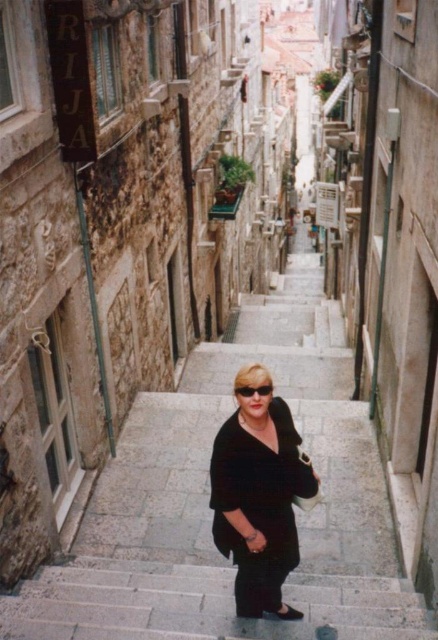
Question: Which point is closer to the camera?

Choices:
 (A) (x=246, y=394)
 (B) (x=274, y=616)
 (C) (x=257, y=540)

Answer: (A)

Question: Which point appears farthest from the camera in this image?

Choices:
 (A) (163, 616)
 (B) (269, 387)
 (C) (212, 586)

Answer: (C)

Question: Can you confirm if stone stairs at center is wider than black matte dress at center?

Choices:
 (A) yes
 (B) no

Answer: (A)

Question: Does smooth stone stairs at center lie in front of black matte sunglasses at center?

Choices:
 (A) no
 (B) yes

Answer: (A)

Question: Which point is farther to the camera?

Choices:
 (A) (328, 467)
 (B) (275, 614)

Answer: (A)

Question: Where is stone stairs at center located in relation to black matte sunglasses at center in the image?

Choices:
 (A) right
 (B) left

Answer: (B)